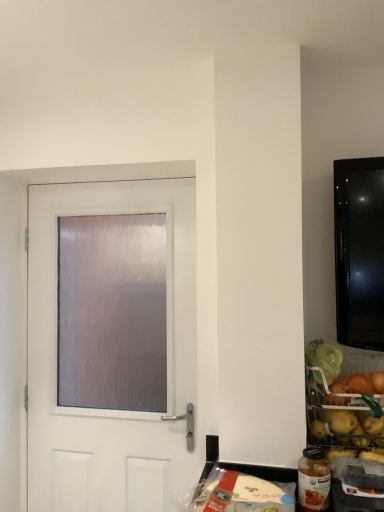
Question: Is point (240, 478) positioned closer to the camera than point (352, 449)?

Choices:
 (A) closer
 (B) farther

Answer: (A)

Question: Is translucent plastic bag at lower center, the first food positioned from the left, situated inside golden potatoes at right, arranged as the 2th food when viewed from the left, or outside?

Choices:
 (A) outside
 (B) inside

Answer: (A)

Question: Which is nearer to the translucent plastic bag at lower center, the first food positioned from the left?

Choices:
 (A) white matte door at center
 (B) golden potatoes at right, the 1th food from the right

Answer: (B)

Question: Which of these objects is positioned closest to the golden potatoes at right, arranged as the 2th food when viewed from the left?

Choices:
 (A) translucent plastic bag at lower center, which is counted as the 1th food, starting from the bottom
 (B) white matte door at center

Answer: (A)